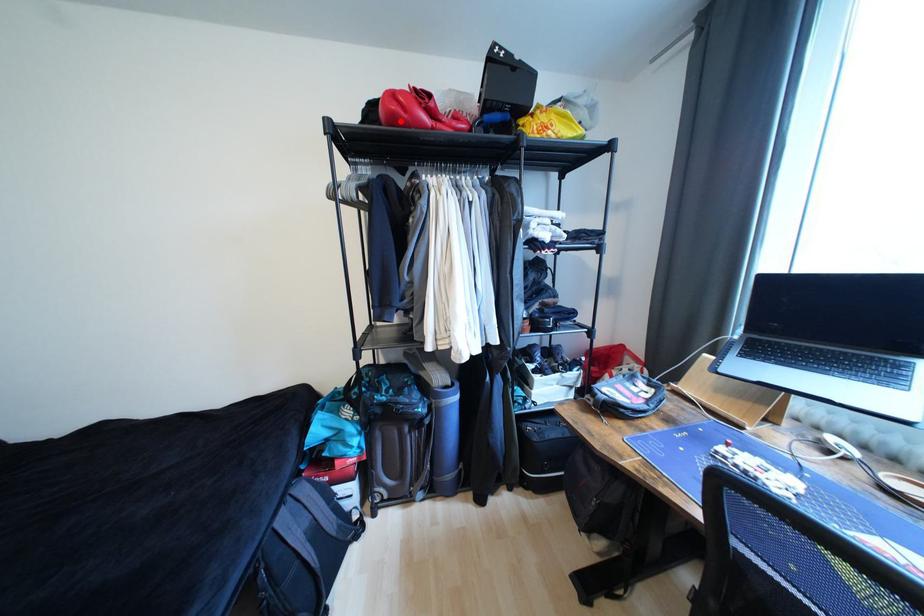
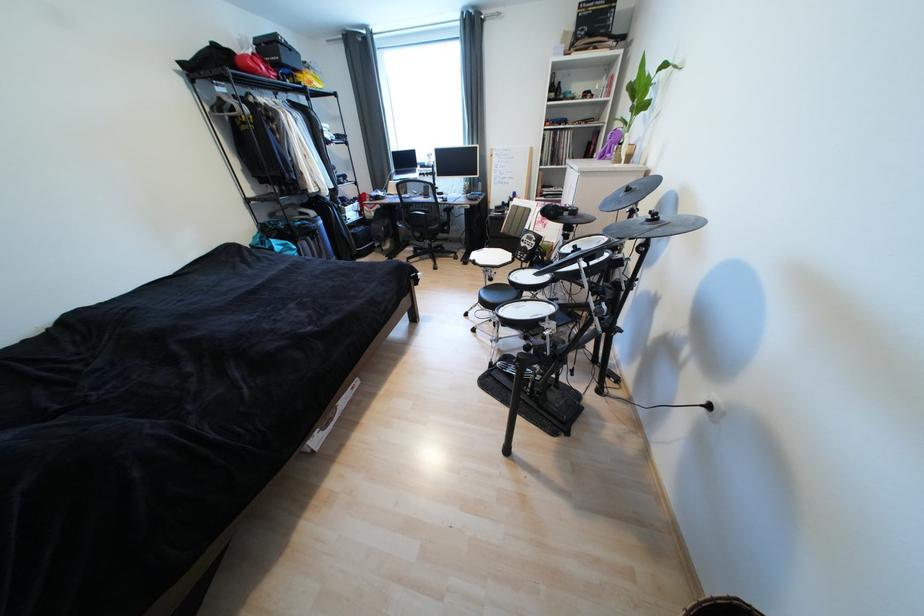
Locate, in the second image, the point that corresponds to the highlighted location in the first image.

(261, 73)